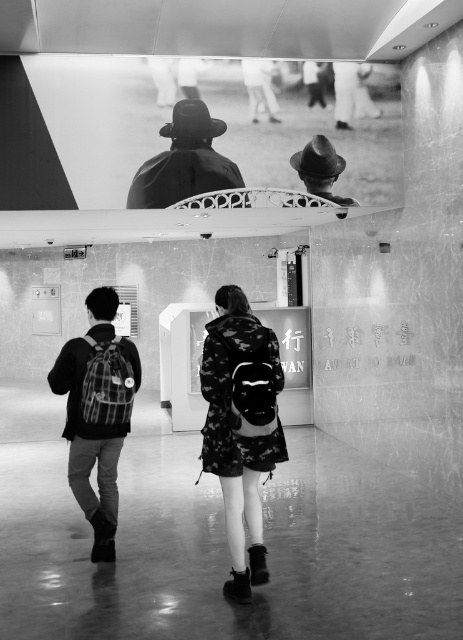
Question: Is camouflage-patterned backpack at center smaller than camo-patterned backpack at center?

Choices:
 (A) yes
 (B) no

Answer: (A)

Question: Does camo-patterned backpack at center appear on the right side of matte black hat at center?

Choices:
 (A) no
 (B) yes

Answer: (A)

Question: Which point is closer to the camera taking this photo?

Choices:
 (A) (336, 160)
 (B) (180, 113)

Answer: (B)

Question: Is camo-patterned backpack at center wider than matte black hat at center?

Choices:
 (A) no
 (B) yes

Answer: (A)

Question: Which object is closer to the camera taking this photo?

Choices:
 (A) matte black hat at center
 (B) camouflage-patterned backpack at center

Answer: (B)

Question: Estimate the real-world distances between objects in this image. Which object is farther from the plaid fabric backpack at left?

Choices:
 (A) matte black hat at upper center
 (B) matte black hat at center
 (C) camouflage-patterned backpack at center
 (D) camo-patterned backpack at center

Answer: (B)